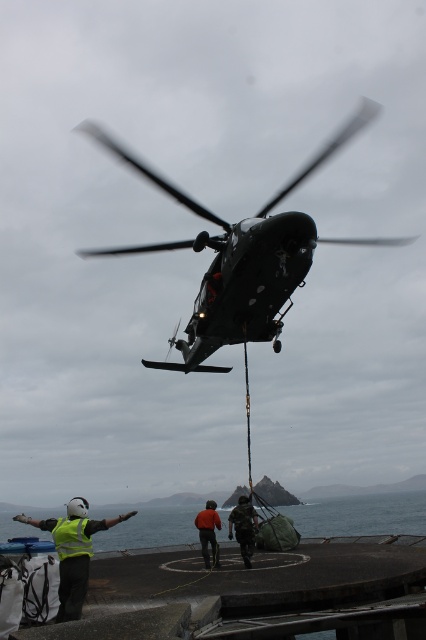
Question: Which of the following is the farthest from the observer?

Choices:
 (A) (207, 532)
 (B) (45, 515)
 (C) (62, 582)
 (D) (241, 529)

Answer: (B)

Question: Can you confirm if dark matte helicopter at center is positioned below orange fabric jacket at center?

Choices:
 (A) yes
 (B) no

Answer: (B)

Question: Is clear blue water at lower center thinner than orange fabric jacket at center?

Choices:
 (A) no
 (B) yes

Answer: (A)

Question: Is dark matte helicopter at center to the left of orange fabric jacket at center from the viewer's perspective?

Choices:
 (A) yes
 (B) no

Answer: (B)

Question: Which object appears farthest from the camera in this image?

Choices:
 (A) dark green uniform at center
 (B) orange fabric jacket at center
 (C) clear blue water at lower center
 (D) dark matte helicopter at center

Answer: (B)

Question: Which point is farther from the camera taking this photo?

Choices:
 (A) (129, 538)
 (B) (95, 528)

Answer: (A)